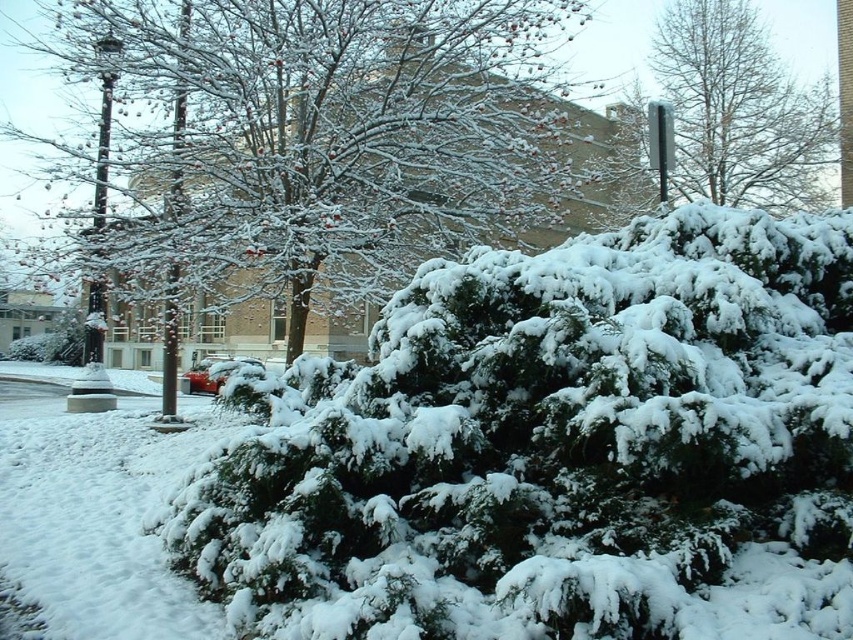
Does green textured bush at upper center appear on the left side of snow-covered evergreen at center?

Incorrect, green textured bush at upper center is not on the left side of snow-covered evergreen at center.

Which is in front, point (817, 179) or point (18, 58)?

Point (817, 179)

Image resolution: width=853 pixels, height=640 pixels. In order to click on green textured bush at upper center in this screenshot , I will do `click(741, 112)`.